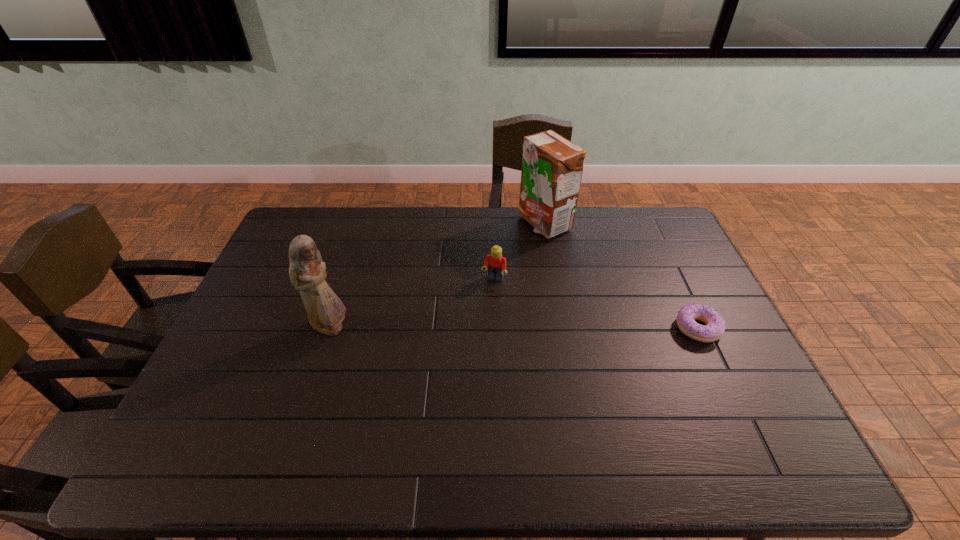
At what (x,y) coordinates should I click in order to perform the action: click on vacant space on the desktop that is between the leftmost object and the doughnut and is positioned on the straw side of the farthest object. Please return your answer as a coordinate pair (x, y). This screenshot has height=540, width=960. Looking at the image, I should click on (509, 328).

Where is `vacant spot on the desktop that is between the leftmost object and the rightmost object and is positioned on the face of the third nearest object`? This screenshot has width=960, height=540. vacant spot on the desktop that is between the leftmost object and the rightmost object and is positioned on the face of the third nearest object is located at coordinates (473, 328).